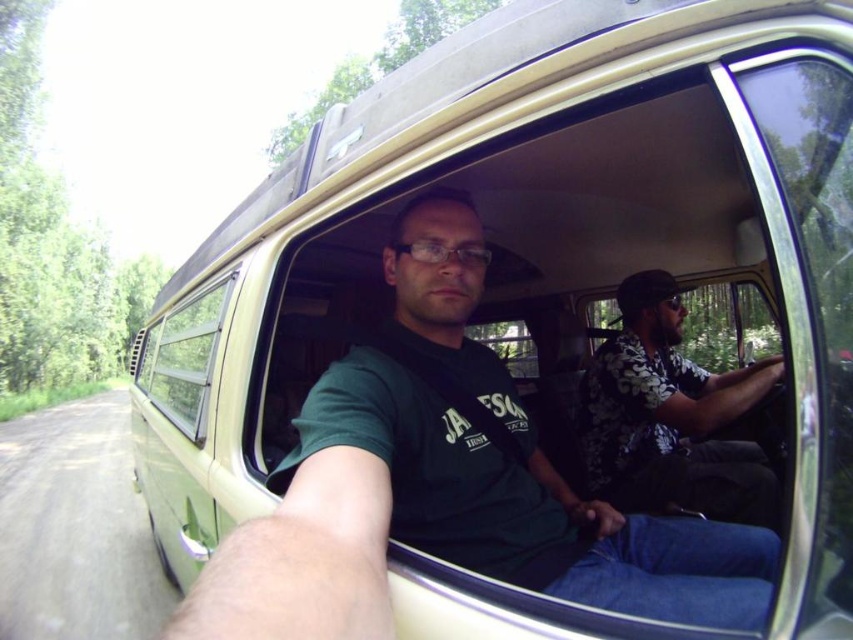
Is floral shirt at center bigger than clear glass window at center?

No, floral shirt at center is not bigger than clear glass window at center.

Can you confirm if floral shirt at center is smaller than clear glass window at center?

Yes.

Is point (676, 454) more distant than point (228, 292)?

Yes, it is.

Identify the location of floral shirt at center. (671, 417).

Is point (440, 461) more distant than point (196, 337)?

No, (440, 461) is closer to viewer.

Between green matte shirt at center and clear glass window at center, which one has less height?

With less height is clear glass window at center.

Where is `green matte shirt at center`? This screenshot has height=640, width=853. green matte shirt at center is located at coordinates (505, 456).

Find the location of `green matte shirt at center`. green matte shirt at center is located at coordinates (505, 456).

Does green matte shirt at center appear on the left side of floral shirt at center?

Indeed, green matte shirt at center is positioned on the left side of floral shirt at center.

Is green matte shirt at center further to the viewer compared to floral shirt at center?

No, it is in front of floral shirt at center.

Which is behind, point (762, 376) or point (659, 493)?

Positioned behind is point (659, 493).

Locate an element on the screen. The image size is (853, 640). green matte shirt at center is located at coordinates (505, 456).